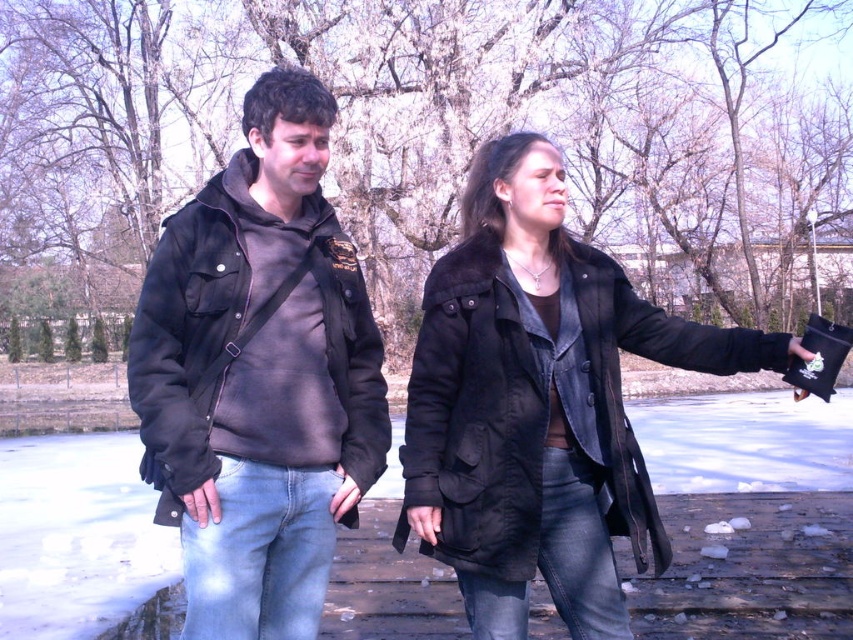
Between matte black jacket at left and matte black coat at center, which one has less height?

With less height is matte black jacket at left.

Which is in front, point (277, 490) or point (483, 364)?

Positioned in front is point (277, 490).

Locate an element on the screen. The height and width of the screenshot is (640, 853). matte black jacket at left is located at coordinates (259, 376).